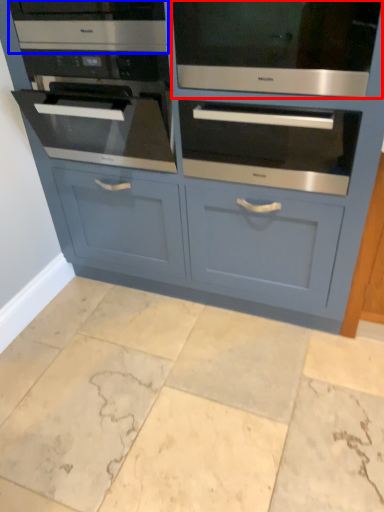
Question: Which object is closer to the camera taking this photo, oven (highlighted by a red box) or appliance (highlighted by a blue box)?

Choices:
 (A) oven
 (B) appliance

Answer: (A)